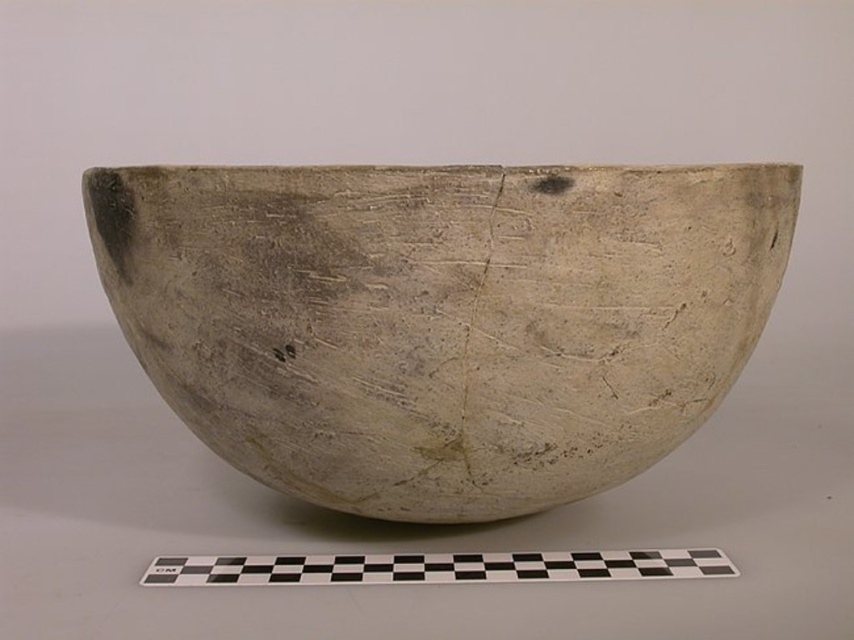
Question: Which of the following is the closest to the observer?

Choices:
 (A) (115, 221)
 (B) (697, 573)

Answer: (A)

Question: In this image, where is matte clay bowl at center located relative to black/white checkered strip at lower center?

Choices:
 (A) right
 (B) left

Answer: (B)

Question: Is matte clay bowl at center further to camera compared to black/white checkered strip at lower center?

Choices:
 (A) no
 (B) yes

Answer: (A)

Question: Among these objects, which one is farthest from the camera?

Choices:
 (A) matte clay bowl at center
 (B) black/white checkered strip at lower center

Answer: (B)

Question: Can you confirm if matte clay bowl at center is positioned to the left of black/white checkered strip at lower center?

Choices:
 (A) no
 (B) yes

Answer: (B)